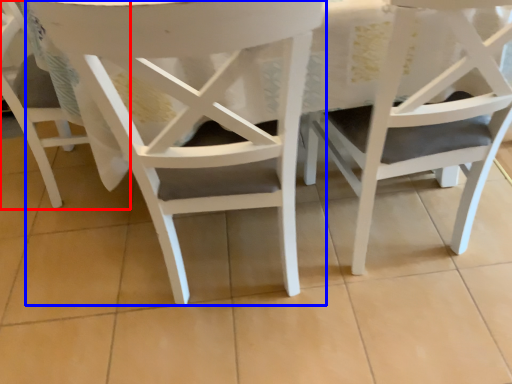
Question: Which object is closer to the camera taking this photo, chair (highlighted by a red box) or chair (highlighted by a blue box)?

Choices:
 (A) chair
 (B) chair

Answer: (B)